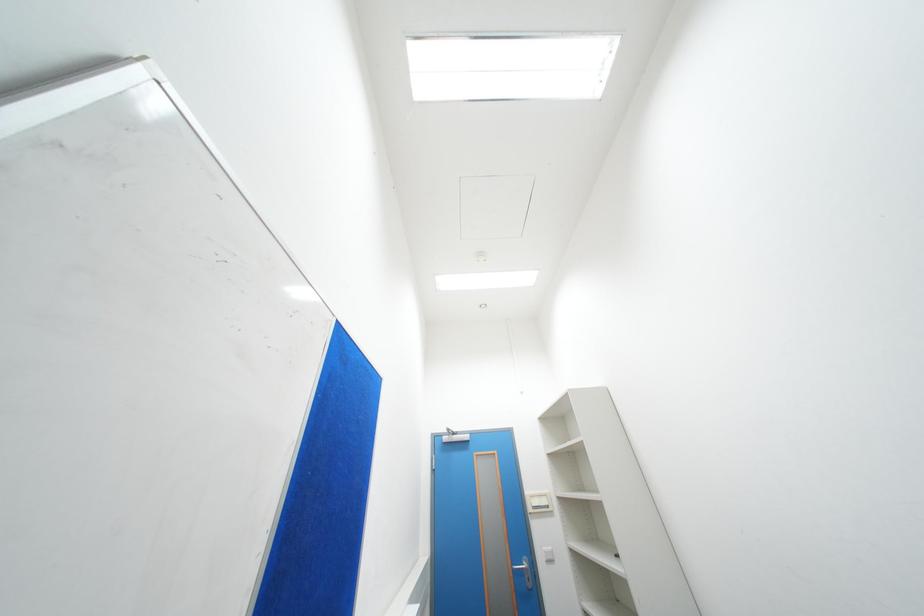
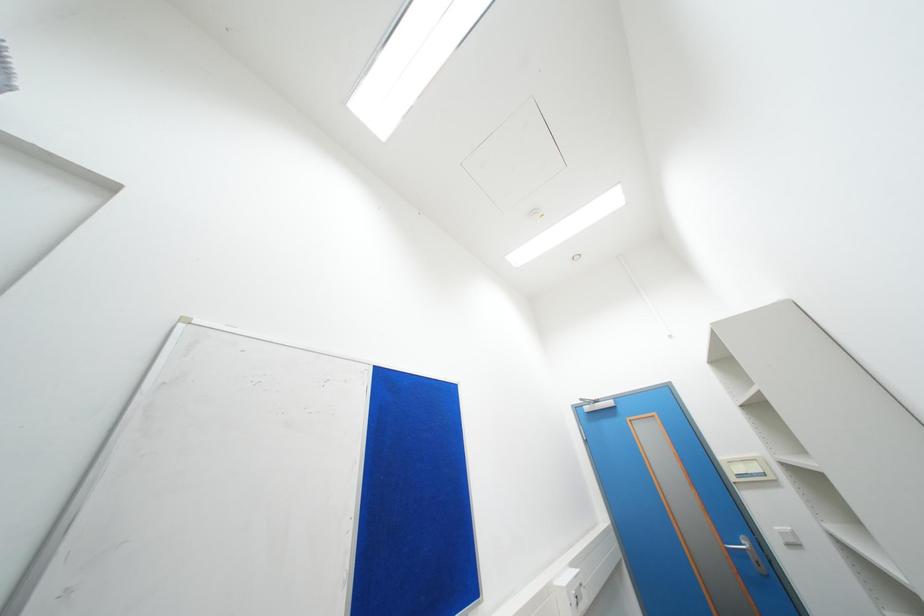
Question: How did the camera likely rotate?

Choices:
 (A) Left
 (B) Right
 (C) Up
 (D) Down

Answer: (A)